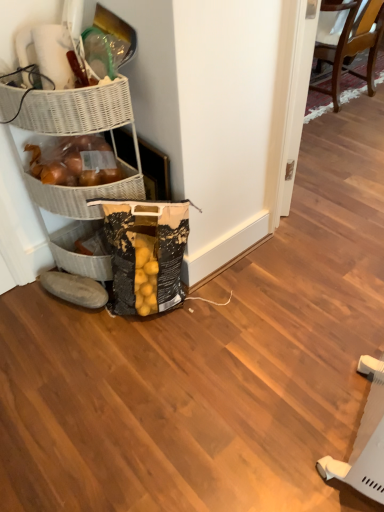
Question: Considering the relative positions of wooden chair at upper right and black textured grocery bag at lower left in the image provided, is wooden chair at upper right to the right of black textured grocery bag at lower left from the viewer's perspective?

Choices:
 (A) yes
 (B) no

Answer: (A)

Question: Considering the relative positions of wooden chair at upper right and black textured grocery bag at lower left in the image provided, is wooden chair at upper right behind black textured grocery bag at lower left?

Choices:
 (A) no
 (B) yes

Answer: (B)

Question: From the image's perspective, would you say wooden chair at upper right is positioned over black textured grocery bag at lower left?

Choices:
 (A) yes
 (B) no

Answer: (A)

Question: Is black textured grocery bag at lower left surrounded by wooden chair at upper right?

Choices:
 (A) no
 (B) yes

Answer: (A)

Question: Does wooden chair at upper right appear on the left side of black textured grocery bag at lower left?

Choices:
 (A) yes
 (B) no

Answer: (B)

Question: Is wooden chair at upper right taller than black textured grocery bag at lower left?

Choices:
 (A) yes
 (B) no

Answer: (A)

Question: Does white wicker basket at upper left have a lesser width compared to gray fabric slipper at lower left?

Choices:
 (A) no
 (B) yes

Answer: (A)

Question: Is white wicker basket at upper left positioned with its back to gray fabric slipper at lower left?

Choices:
 (A) yes
 (B) no

Answer: (B)

Question: Does white wicker basket at upper left have a larger size compared to gray fabric slipper at lower left?

Choices:
 (A) yes
 (B) no

Answer: (A)

Question: Can you confirm if white wicker basket at upper left is smaller than gray fabric slipper at lower left?

Choices:
 (A) yes
 (B) no

Answer: (B)

Question: Could you tell me if white wicker basket at upper left is facing gray fabric slipper at lower left?

Choices:
 (A) no
 (B) yes

Answer: (A)

Question: From the image's perspective, is white wicker basket at upper left over gray fabric slipper at lower left?

Choices:
 (A) no
 (B) yes

Answer: (B)

Question: From a real-world perspective, does black textured grocery bag at lower left stand above wooden chair at upper right?

Choices:
 (A) yes
 (B) no

Answer: (B)